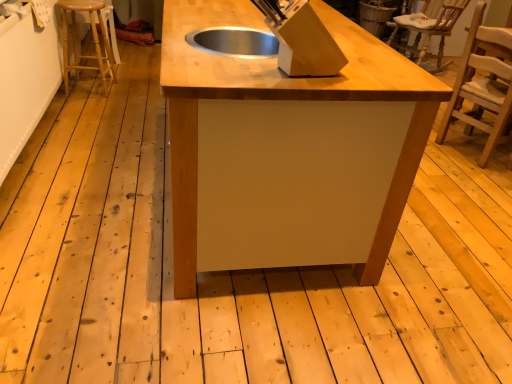
At what (x,y) coordinates should I click in order to perform the action: click on vacant area that is in front of light brown wooden stool at left. Please return your answer as a coordinate pair (x, y). Looking at the image, I should click on (87, 106).